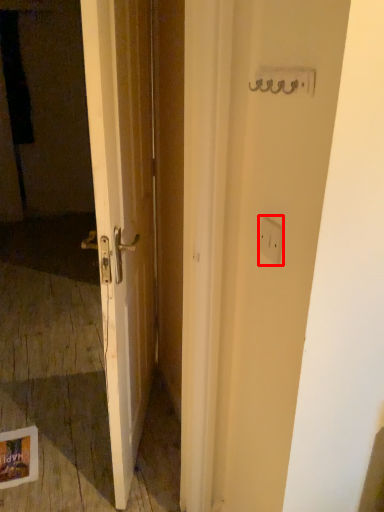
Question: From the image's perspective, where is electric outlet (annotated by the red box) located in relation to screen door in the image?

Choices:
 (A) above
 (B) below

Answer: (B)